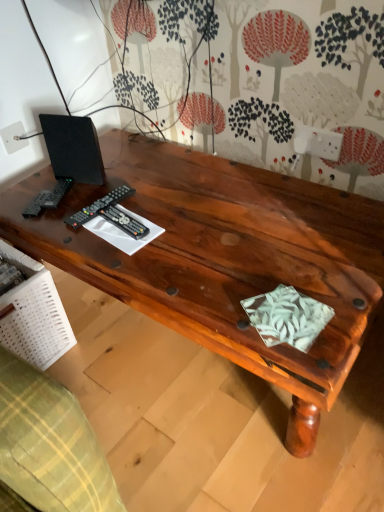
In order to click on free location above shiny brown wood desk at center (from a real-world perspective) in this screenshot , I will do `click(199, 224)`.